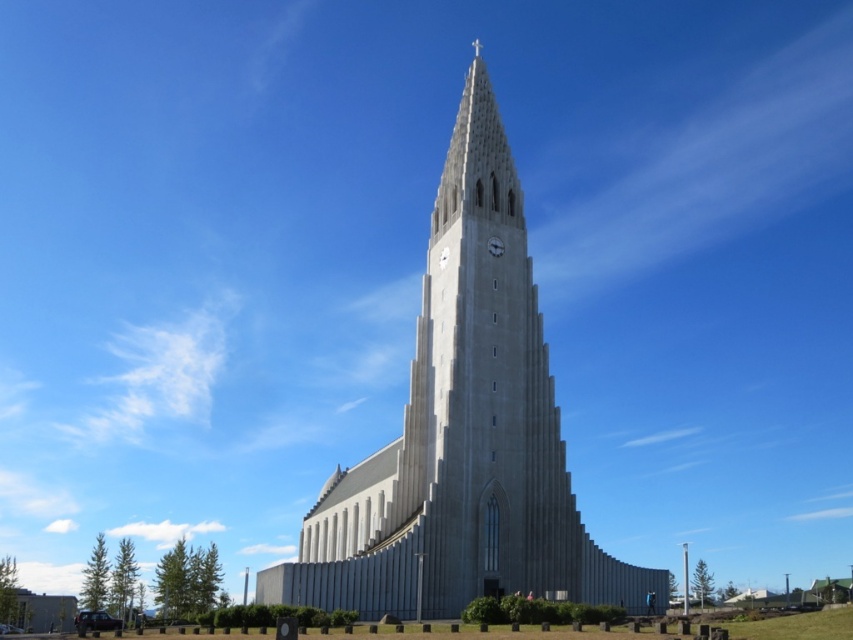
You are standing in front of the gray stone church at center and want to locate the metallic gray clock at center. In which direction should you look relative to the church?

The metallic gray clock at center is to the right of the gray stone church at center, so you should look to the right side of the church to find it.

Looking at this image, you are standing in front of the gray stone church at center and want to see the metallic gray clock at center. In which direction should you look relative to the church?

The metallic gray clock at center is located above the gray stone church at center, so you should look upward to see it.